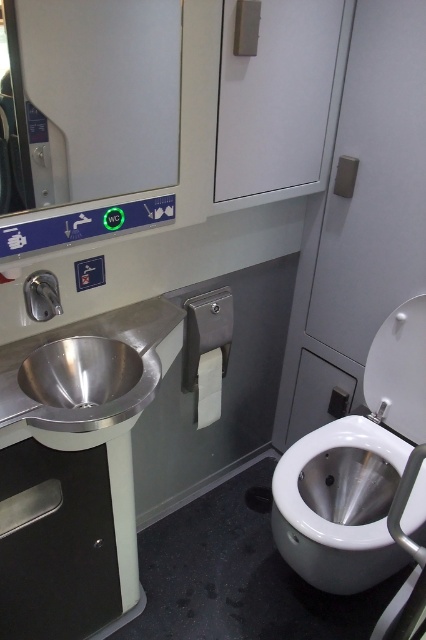
Does white glossy toilet bowl at lower right have a greater width compared to polished stainless steel sink at left?

Yes.

Which of these two, white glossy toilet bowl at lower right or polished stainless steel sink at left, stands taller?

Standing taller between the two is white glossy toilet bowl at lower right.

Does point (386, 444) come closer to viewer compared to point (138, 358)?

That is False.

Image resolution: width=426 pixels, height=640 pixels. I want to click on white glossy toilet bowl at lower right, so click(339, 504).